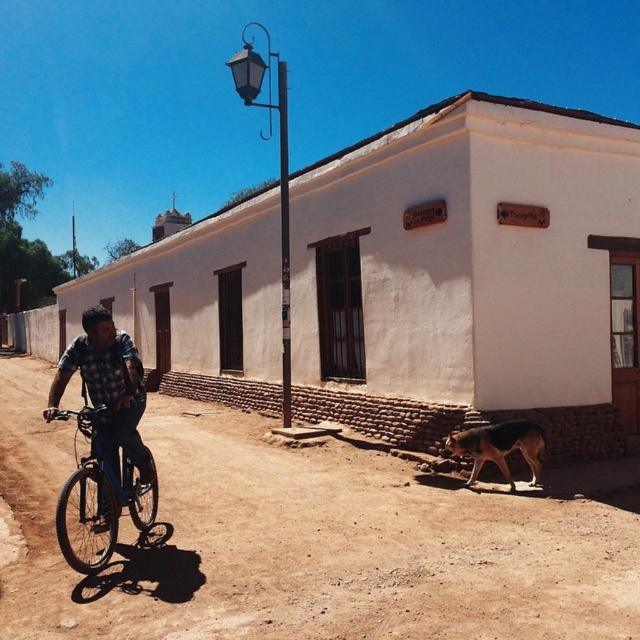
Question: Which point is closer to the camera?

Choices:
 (A) (500, 426)
 (B) (65, 360)

Answer: (B)

Question: Can you confirm if brown dirt track at lower center is positioned below matte black bicycle at left?

Choices:
 (A) no
 (B) yes

Answer: (B)

Question: Is brown dirt track at lower center thinner than matte black bicycle at left?

Choices:
 (A) no
 (B) yes

Answer: (A)

Question: Which object is positioned closest to the brown dirt track at lower center?

Choices:
 (A) checkered fabric shirt at left
 (B) matte black bicycle at left
 (C) brown fur dog at lower right

Answer: (C)

Question: Is checkered fabric shirt at left smaller than matte black bicycle at left?

Choices:
 (A) no
 (B) yes

Answer: (A)

Question: Which point is farther from the camera taking this photo?

Choices:
 (A) (141, 554)
 (B) (115, 342)
 (C) (492, 458)

Answer: (C)